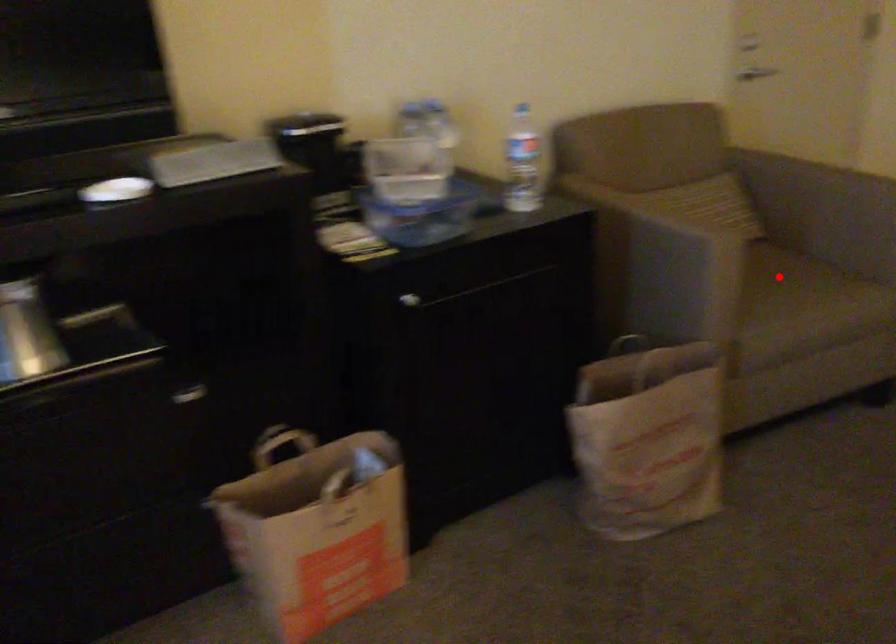
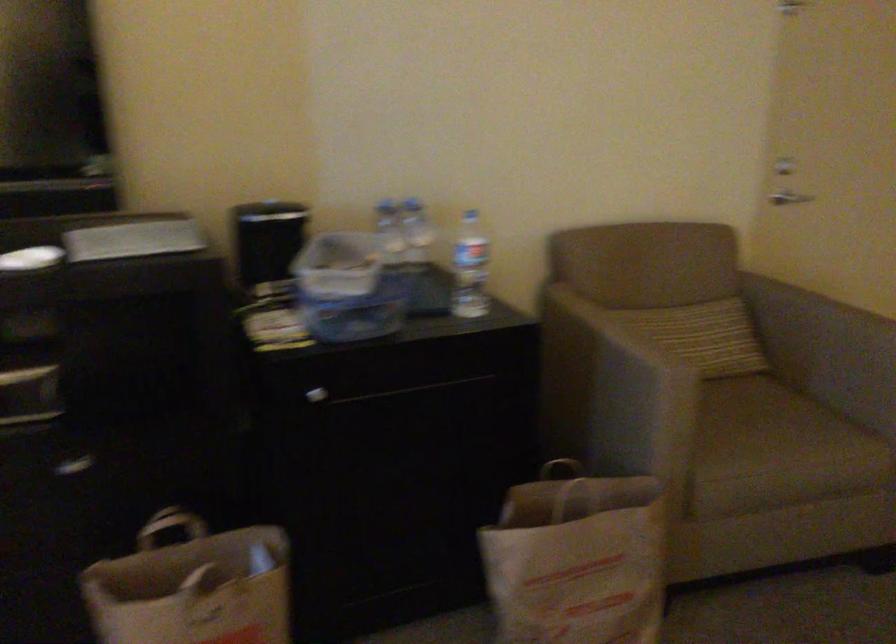
In the second image, find the point that corresponds to the highlighted location in the first image.

(762, 418)